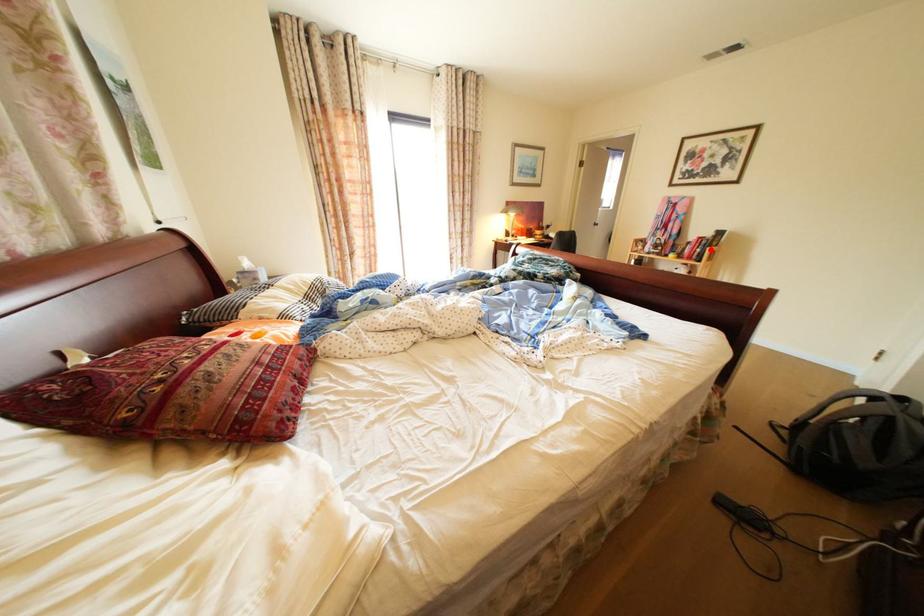
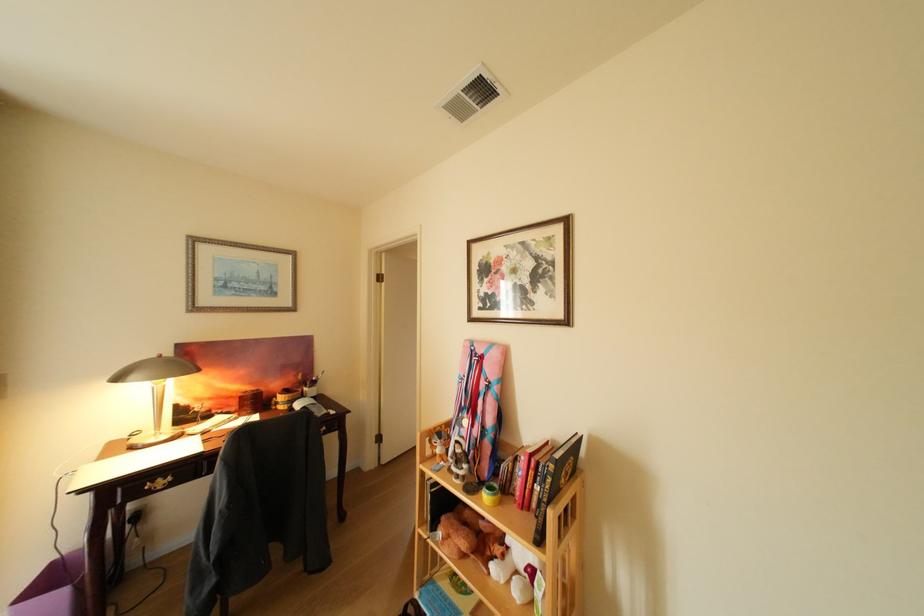
In the second image, find the point that corresponds to the highlighted location in the first image.

(548, 484)